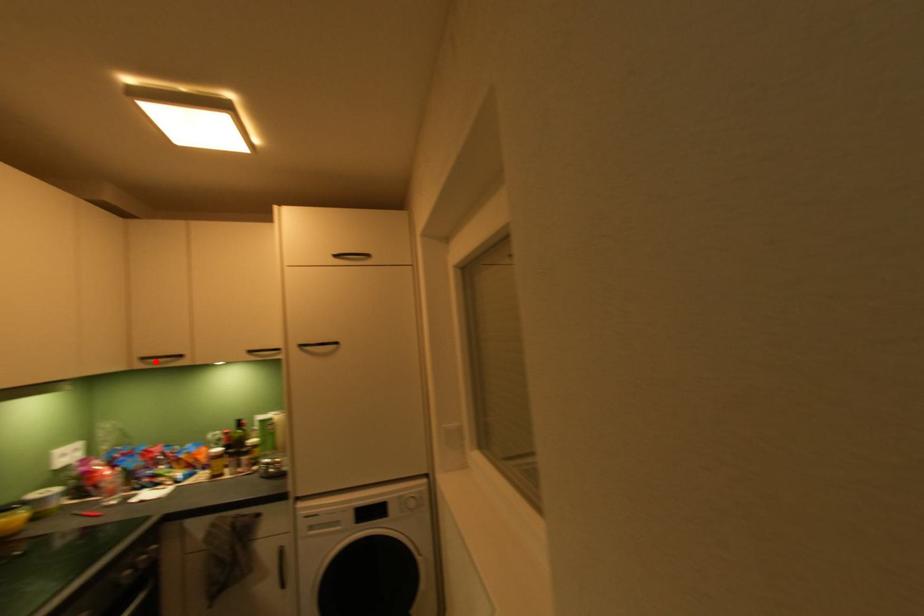
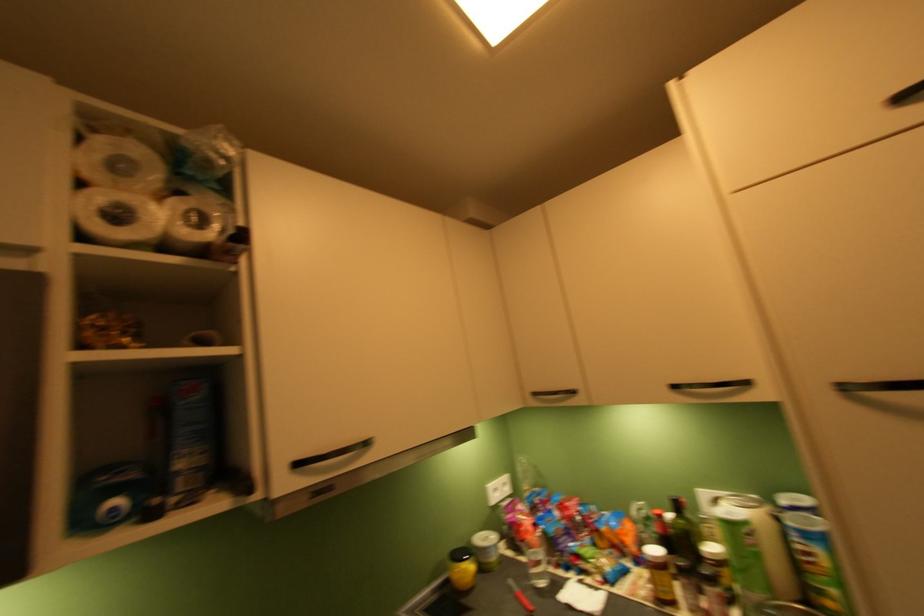
Where in the second image is the point corresponding to the highlighted location from the first image?

(546, 398)